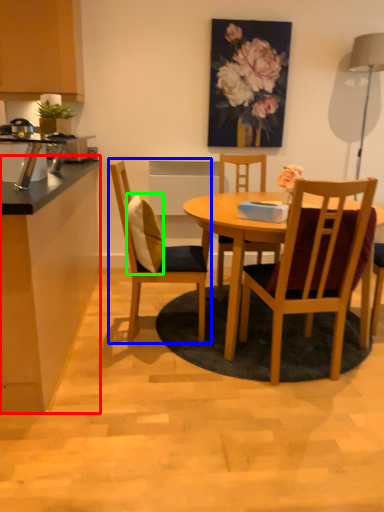
Question: Which object is the farthest from counter top (highlighted by a red box)? Choose among these: chair (highlighted by a blue box) or pillow (highlighted by a green box).

Choices:
 (A) chair
 (B) pillow

Answer: (B)